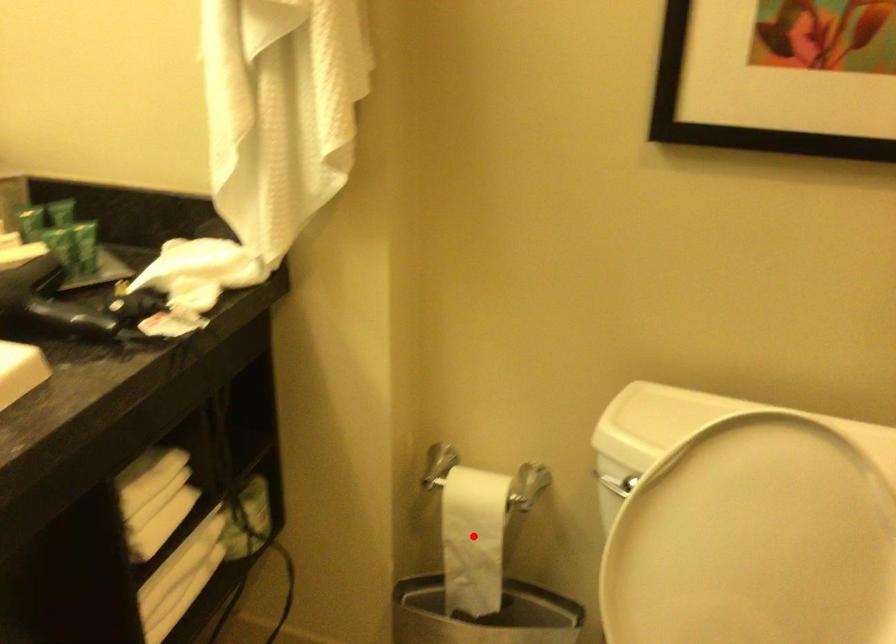
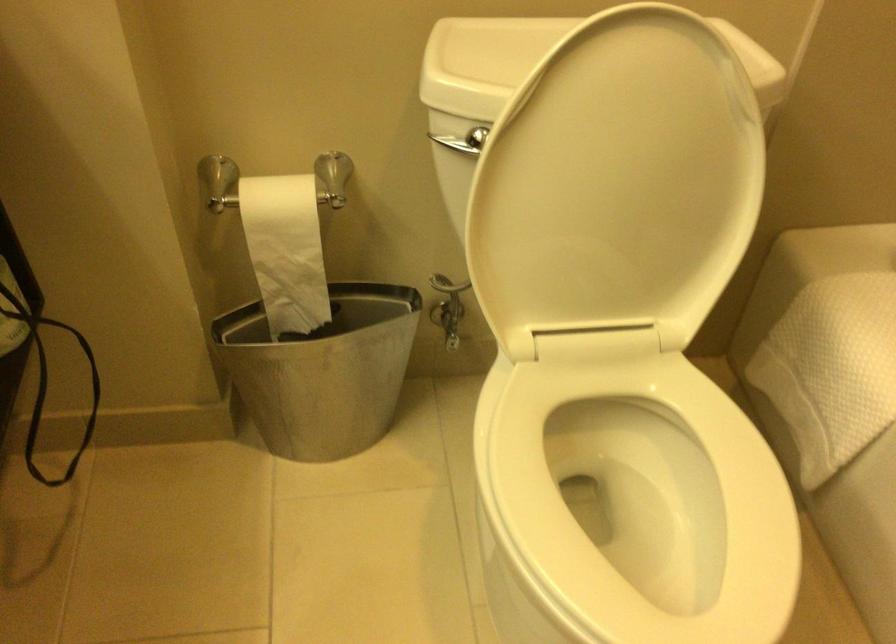
Question: I am providing you with two images of the same scene from different viewpoints. In image1, a red point is highlighted. Considering the same 3D point in image2, which of the following is correct?

Choices:
 (A) It is closer
 (B) It is farther

Answer: (A)